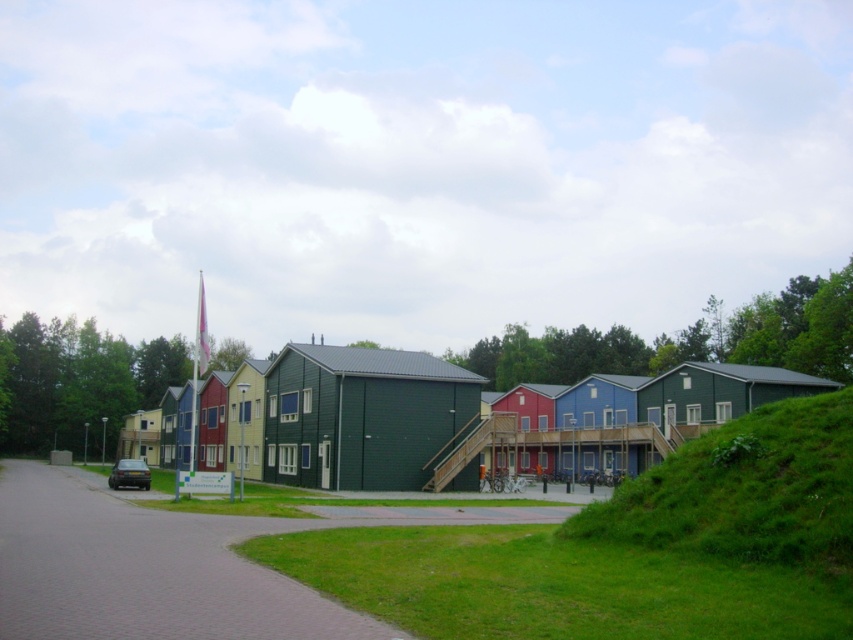
Question: Which point is closer to the camera?

Choices:
 (A) (676, 465)
 (B) (349, 468)

Answer: (A)

Question: Can you confirm if green grassy hillside at lower right is smaller than green wooden house at center?

Choices:
 (A) yes
 (B) no

Answer: (B)

Question: Among these objects, which one is nearest to the camera?

Choices:
 (A) green wooden house at center
 (B) green grassy hillside at lower right

Answer: (B)

Question: Is green grassy hillside at lower right wider than green wooden house at center?

Choices:
 (A) no
 (B) yes

Answer: (A)

Question: Does green grassy hillside at lower right appear on the left side of green wooden house at center?

Choices:
 (A) no
 (B) yes

Answer: (A)